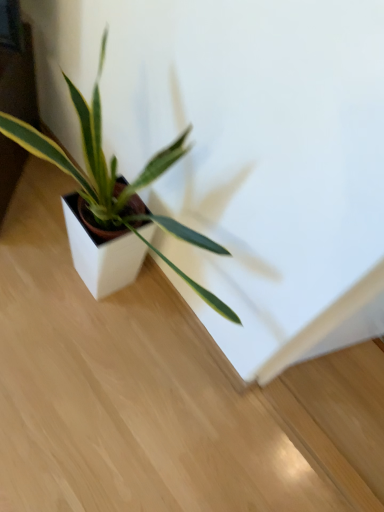
I want to click on free space on the front side of green matte plant at center-left, so click(x=66, y=417).